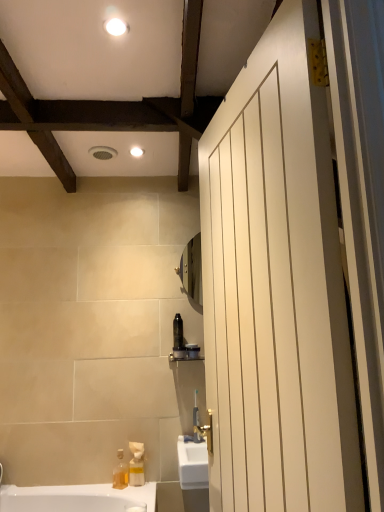
Image resolution: width=384 pixels, height=512 pixels. Find the location of `free space to the back side of white glossy light fixture at upper center, placed as the second light fixture when sorted from bottom to top`. free space to the back side of white glossy light fixture at upper center, placed as the second light fixture when sorted from bottom to top is located at coordinates (129, 59).